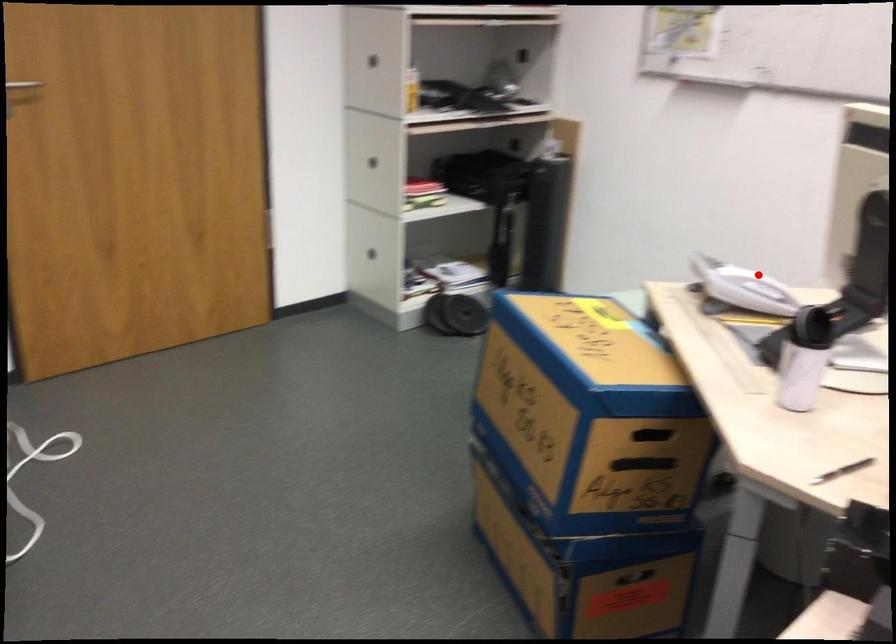
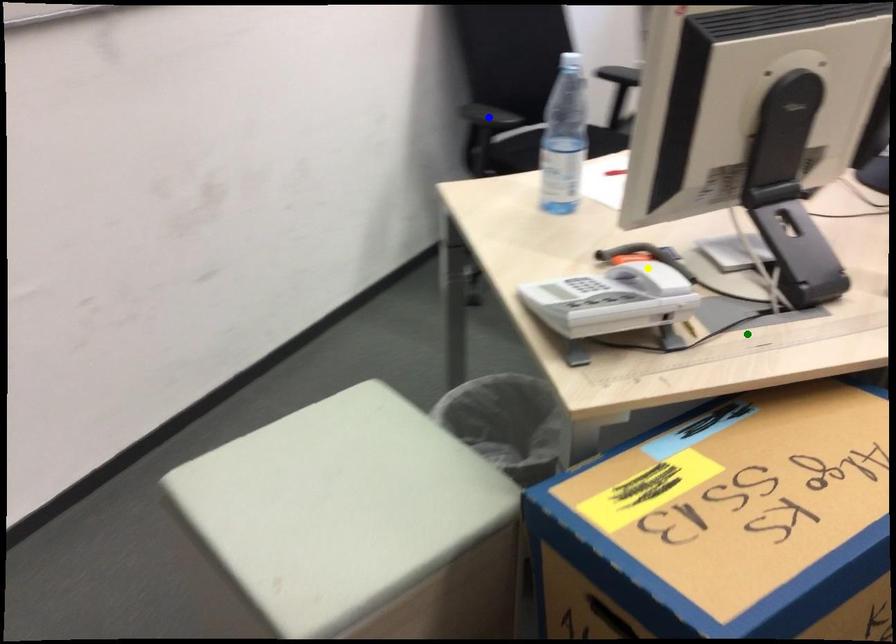
Question: I am providing you with two images of the same scene from different viewpoints. A red point is marked on the first image. You are given multiple points on the second image. Which point in image 2 represents the same 3d spot as the red point in image 1?

Choices:
 (A) blue point
 (B) yellow point
 (C) green point

Answer: (B)